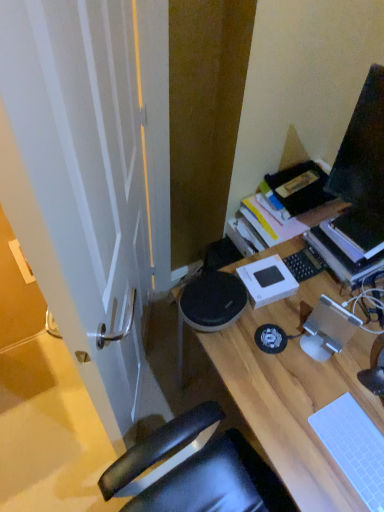
Where is `free area below white matte laptop keyboard at lower right, the second laptop keyboard when ordered from back to front (from a real-world perspective)`? free area below white matte laptop keyboard at lower right, the second laptop keyboard when ordered from back to front (from a real-world perspective) is located at coordinates pyautogui.click(x=356, y=452).